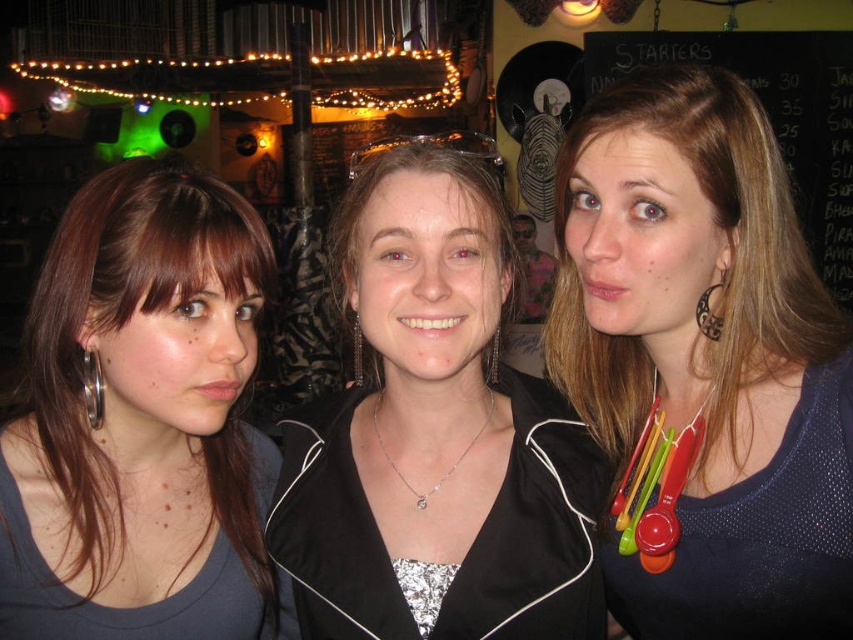
You are at a bar and want to order a drink. You see a matte gray tank top at left and a black chalkboard at upper right. Which object is closer to the ceiling?

The black chalkboard at upper right is closer to the ceiling because the matte gray tank top at left is below it.

You are a photographer adjusting your camera settings to focus on the matte gray tank top at left and the black chalkboard at upper right. Which object should you focus on first to ensure both are in sharp focus?

You should focus on the matte gray tank top at left first because it is closer to the viewer than the black chalkboard at upper right, so starting with the closer object will help achieve focus on both.